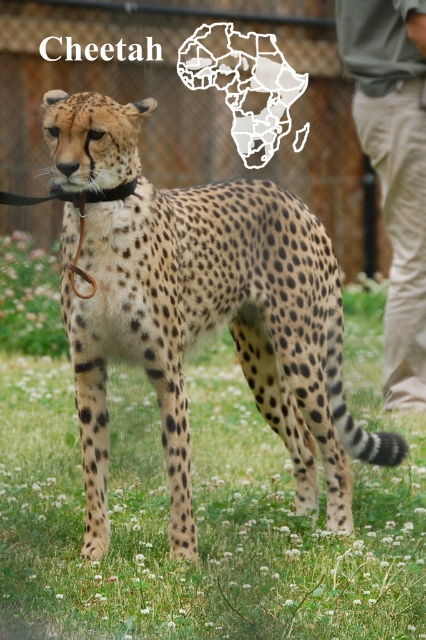
Identify the location of green grass at center. (204, 513).

Consider the image. Is green grass at center above spotted fur cheetah at center?

No.

Describe the element at coordinates (204, 513) in the screenshot. I see `green grass at center` at that location.

You are a GUI agent. You are given a task and a screenshot of the screen. Output one action in this format:
    pyautogui.click(x=<x>, y=<y>)
    Task: Click on the green grass at center
    
    Given the screenshot: What is the action you would take?
    pyautogui.click(x=204, y=513)

Is spotted fur cheetah at center smaller than black leather neckband at center?

Actually, spotted fur cheetah at center might be larger than black leather neckband at center.

Between point (310, 352) and point (34, 200), which one is positioned behind?

Positioned behind is point (310, 352).

The width and height of the screenshot is (426, 640). Identify the location of spotted fur cheetah at center. (201, 310).

Does point (52, 570) come closer to viewer compared to point (14, 202)?

No, it is behind (14, 202).

Is green grass at center wider than black leather neckband at center?

Correct, the width of green grass at center exceeds that of black leather neckband at center.

Identify the location of green grass at center. This screenshot has width=426, height=640. (204, 513).

Find the location of a particular element. The image size is (426, 640). green grass at center is located at coordinates (204, 513).